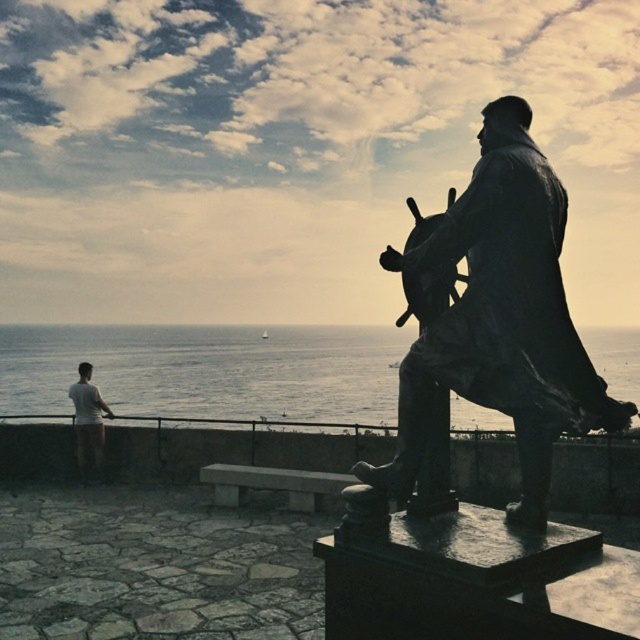
You are a photographer standing at the base of the statue. You want to capture a photo where both the silvery water at lower left and the shiny metal gun at center are visible in the frame. Based on their positions, which object should you focus on first to ensure both are in the shot?

Since the silvery water at lower left is below the shiny metal gun at center, you should focus on the shiny metal gun at center first to ensure both are in the frame.

You are a photographer standing at the center of the scene. You want to take a photo focusing on the bronze ship captain at right and the white cotton shorts at lower left. Which object should you adjust your camera focus first to ensure both are in the frame?

Since the bronze ship captain at right is closer to the viewer than the white cotton shorts at lower left, you should focus on the bronze ship captain at right first to ensure both are in the frame.